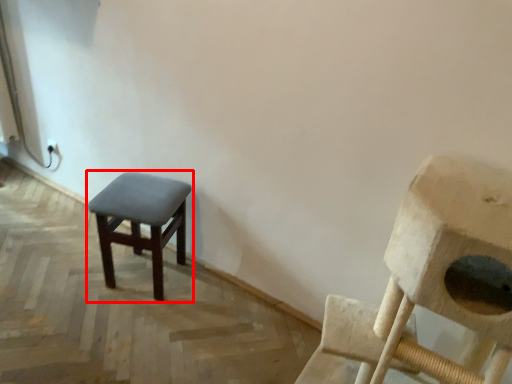
Question: From the image's perspective, where is stool (annotated by the red box) located relative to chair?

Choices:
 (A) below
 (B) above

Answer: (B)